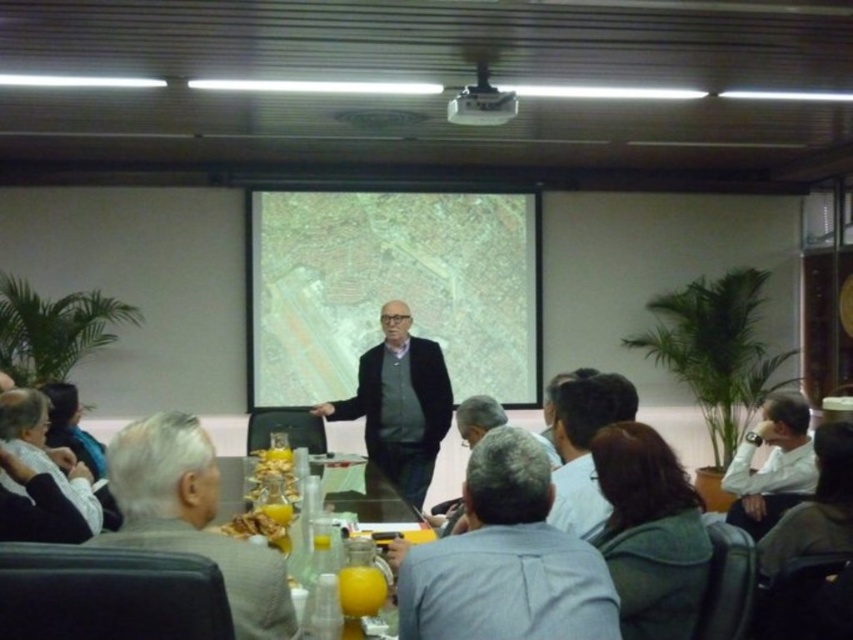
Question: Does gray suit at center have a lesser width compared to white plastic projector at upper center?

Choices:
 (A) yes
 (B) no

Answer: (B)

Question: Among these objects, which one is farthest from the camera?

Choices:
 (A) gray fabric shirt at center
 (B) white fabric at lower left
 (C) gray suit at center
 (D) matte black jacket at center

Answer: (D)

Question: Which of the following is the closest to the observer?

Choices:
 (A) (634, 406)
 (B) (276, 355)

Answer: (A)

Question: Which point is farther to the camera?

Choices:
 (A) (463, 122)
 (B) (512, 509)
 (C) (515, 227)
 (D) (755, 504)

Answer: (C)

Question: Does white shirt at lower right appear on the left side of white plastic projector at upper center?

Choices:
 (A) yes
 (B) no

Answer: (B)

Question: Can you confirm if gray fabric shirt at center is positioned to the right of white plastic projector at upper center?

Choices:
 (A) yes
 (B) no

Answer: (A)